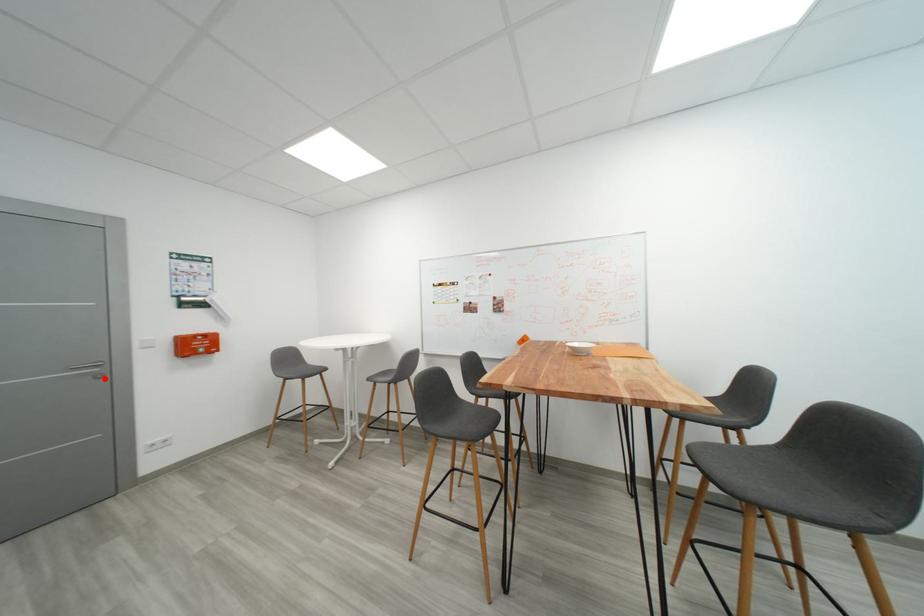
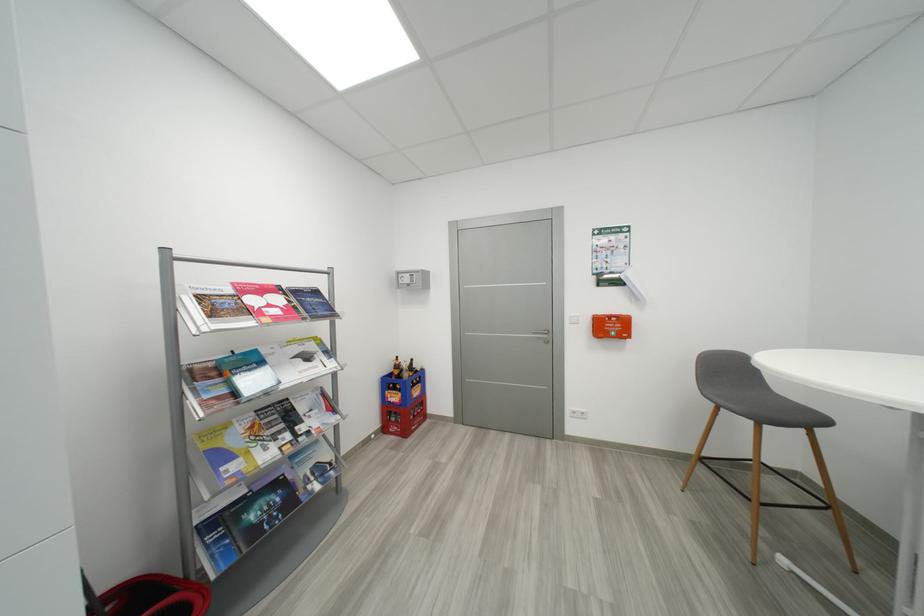
Where in the second image is the point corresponding to the highlighted location from the first image?

(553, 344)